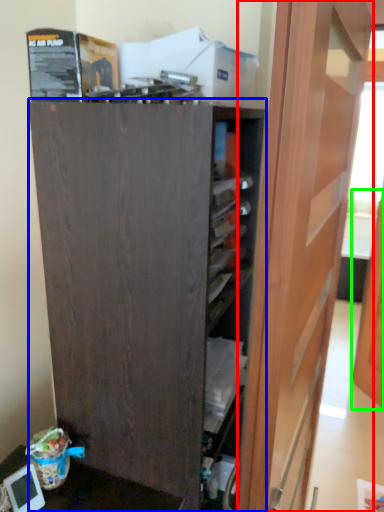
Question: Considering the real-world distances, which object is farthest from door (highlighted by a red box)? cupboard (highlighted by a blue box) or door (highlighted by a green box)?

Choices:
 (A) cupboard
 (B) door

Answer: (B)